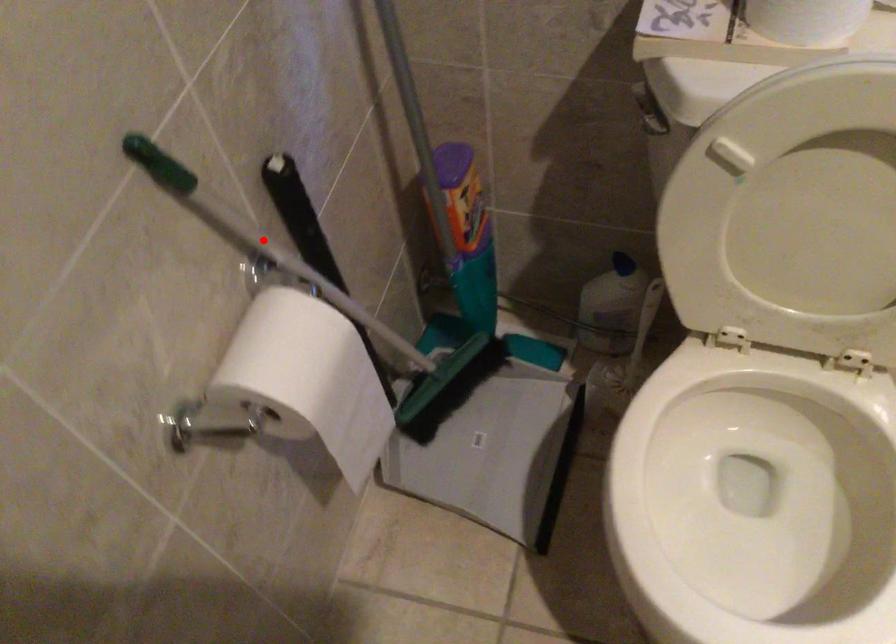
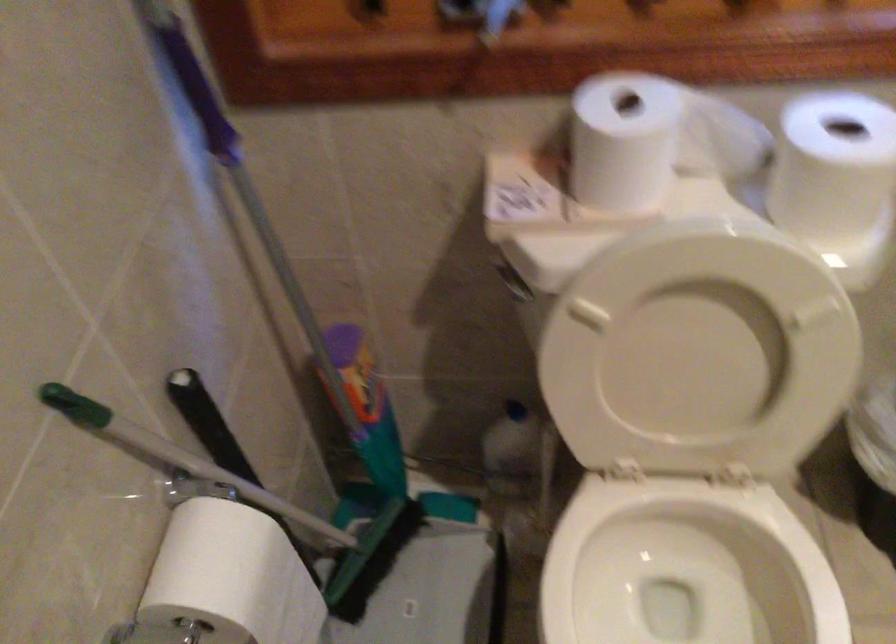
In the second image, find the point that corresponds to the highlighted location in the first image.

(177, 457)